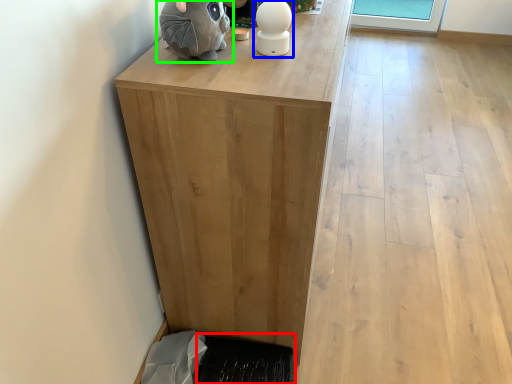
Question: Estimate the real-world distances between objects in this image. Which object is closer to doormat (highlighted by a red box), figurine (highlighted by a blue box) or toy (highlighted by a green box)?

Choices:
 (A) figurine
 (B) toy

Answer: (A)